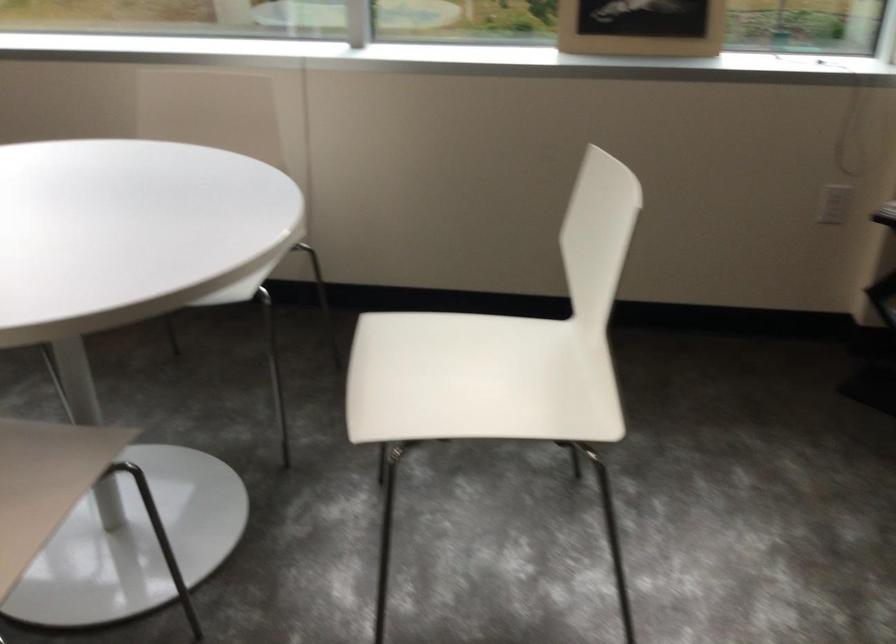
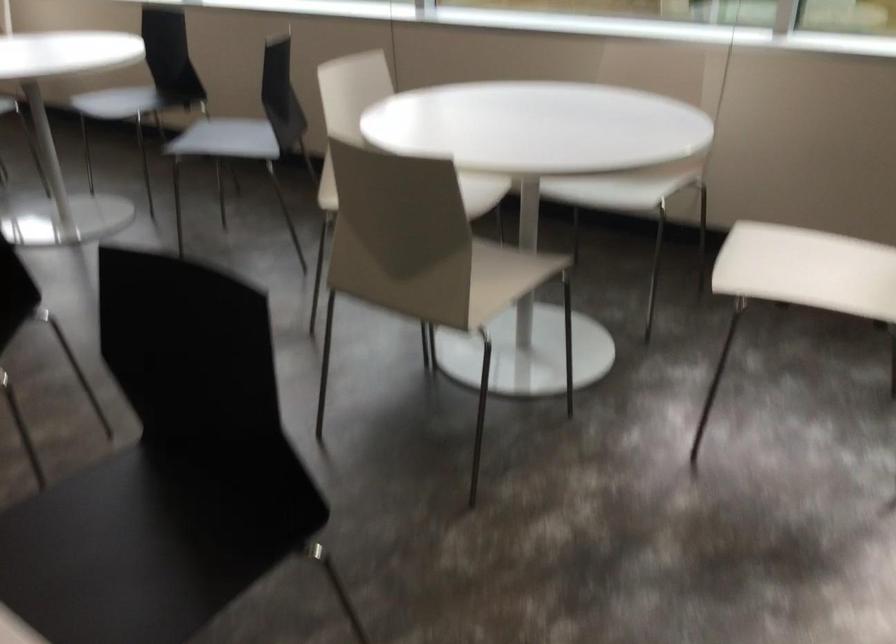
Question: In a continuous first-person perspective shot, in which direction is the camera moving?

Choices:
 (A) Left
 (B) Right
 (C) Forward
 (D) Backward

Answer: (D)